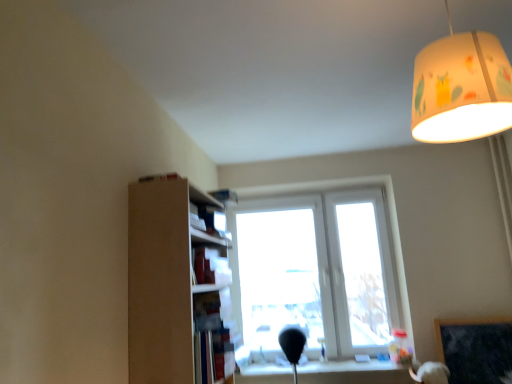
Question: Should I look upward or downward to see hardcover book at upper center?

Choices:
 (A) down
 (B) up

Answer: (A)

Question: Is brown cardboard shelf at left located outside dark gray matte bulletin board at lower right?

Choices:
 (A) no
 (B) yes

Answer: (B)

Question: Can you confirm if brown cardboard shelf at left is bigger than dark gray matte bulletin board at lower right?

Choices:
 (A) yes
 (B) no

Answer: (A)

Question: Can you confirm if brown cardboard shelf at left is smaller than dark gray matte bulletin board at lower right?

Choices:
 (A) no
 (B) yes

Answer: (A)

Question: Is brown cardboard shelf at left closer to the viewer compared to dark gray matte bulletin board at lower right?

Choices:
 (A) no
 (B) yes

Answer: (B)

Question: From the image's perspective, is brown cardboard shelf at left beneath dark gray matte bulletin board at lower right?

Choices:
 (A) no
 (B) yes

Answer: (A)

Question: From a real-world perspective, is brown cardboard shelf at left over dark gray matte bulletin board at lower right?

Choices:
 (A) no
 (B) yes

Answer: (B)

Question: Is white fabric lampshade at upper right bigger than brown cardboard shelf at left?

Choices:
 (A) no
 (B) yes

Answer: (A)

Question: Is white fabric lampshade at upper right taller than brown cardboard shelf at left?

Choices:
 (A) yes
 (B) no

Answer: (B)

Question: Can you confirm if white fabric lampshade at upper right is thinner than brown cardboard shelf at left?

Choices:
 (A) no
 (B) yes

Answer: (A)

Question: From the image's perspective, is white fabric lampshade at upper right over brown cardboard shelf at left?

Choices:
 (A) no
 (B) yes

Answer: (B)

Question: Is white fabric lampshade at upper right wider than brown cardboard shelf at left?

Choices:
 (A) yes
 (B) no

Answer: (A)

Question: Does white fabric lampshade at upper right appear on the left side of brown cardboard shelf at left?

Choices:
 (A) yes
 (B) no

Answer: (B)

Question: From the image's perspective, is brown cardboard shelf at left on hardcover book at upper center?

Choices:
 (A) yes
 (B) no

Answer: (B)